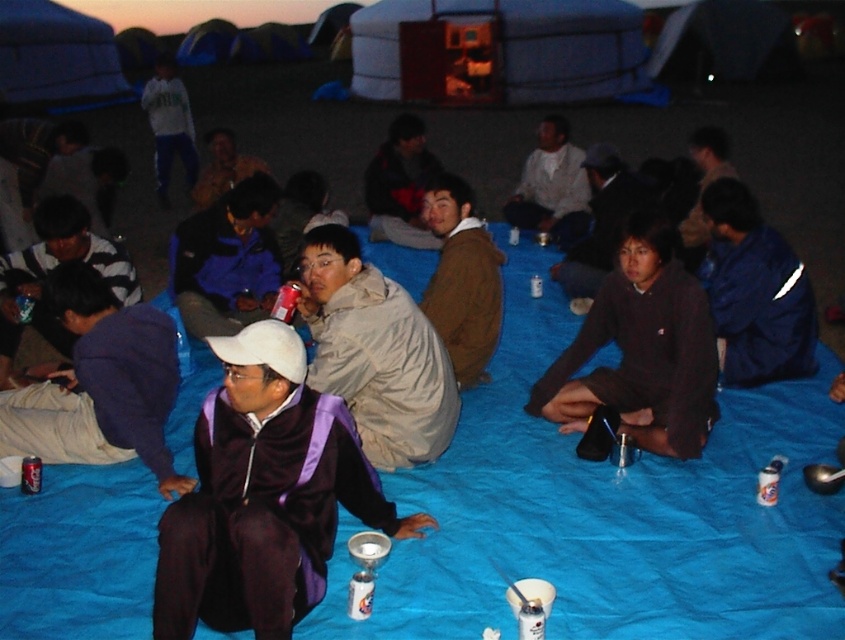
You are organizing a camping trip and need to choose between the white plastic cup at lower center and the metallic can at center for serving drinks. Which option is shorter?

The white plastic cup at lower center is not as tall as the metallic can at center, so the cup is shorter.

You are organizing a camping trip and want to pack both the brown wool sweater at center and the metallic can at center into a backpack compartment that can only hold items up to 30 cm in width. Based on their sizes, will both items fit side by side?

The brown wool sweater at center might be wider than metallic can at center. Since the sweater could be wider than 30 cm, it might not fit alongside the can in the backpack compartment.